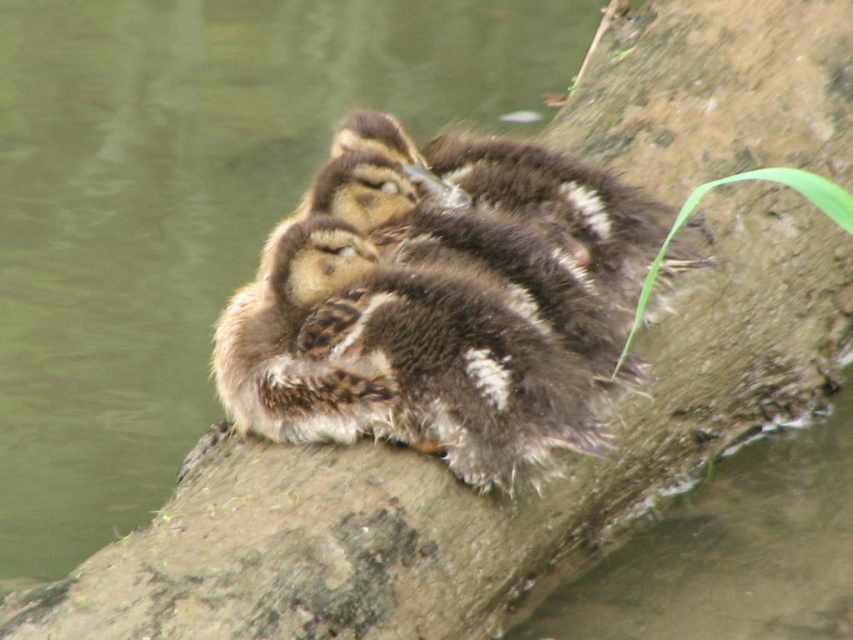
Question: Is brown fuzzy ducklings at center in front of brown fluffy ducklings at center?

Choices:
 (A) yes
 (B) no

Answer: (B)

Question: Which object appears farthest from the camera in this image?

Choices:
 (A) brown fuzzy ducklings at center
 (B) brown fluffy ducklings at center

Answer: (A)

Question: Can you confirm if brown fuzzy ducklings at center is bigger than brown fluffy ducklings at center?

Choices:
 (A) no
 (B) yes

Answer: (B)

Question: Is brown fuzzy ducklings at center positioned at the back of brown fluffy ducklings at center?

Choices:
 (A) yes
 (B) no

Answer: (A)

Question: Which point appears closest to the camera in this image?

Choices:
 (A) (x=506, y=448)
 (B) (x=10, y=45)

Answer: (A)